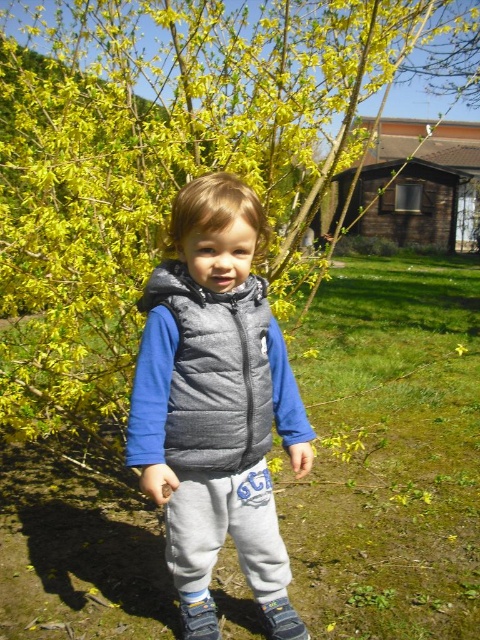
You are a photographer trying to capture a photo of the child in the scene. You notice two points marked in the image. The first point is at coordinate point [154,630] and the second is at point [210,340]. Which of these points is closer to the camera lens?

Point [154,630] is closer to the camera lens because it is further to the viewer than point [210,340].

You are a drone operator trying to capture a photo of the gray puffer vest at center while avoiding the green grass at center. Given that your drone can hover at least 1.5 meters away from the vest, will you be able to avoid the grass?

The green grass at center is only 1.34 meters away from the gray puffer vest at center, so the drone can hover 1.5 meters away from the vest and still be 0.16 meters beyond the grass, thus avoiding it.